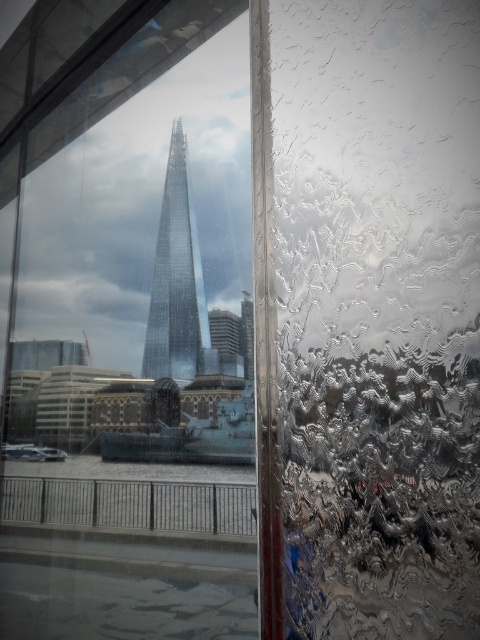
You are an architect analyzing the structural integrity of the transparent glass window at center and the transparent glass tower at center. Which one has a greater height?

The transparent glass window at center is much taller than the transparent glass tower at center according to the description.

You are standing in a room with a window. You want to touch the glass at point (132, 344). Is that point on the transparent glass window at center?

Yes, the point (132, 344) is on the transparent glass window at center.

You are looking through the window at the London skyline. There are two points marked on the window, one at coordinates point (48,154) and another at point (152,307). Which point is closer to your eyes?

Point (48,154) is further to the camera than point (152,307), so the closer point to your eyes is point (152,307).